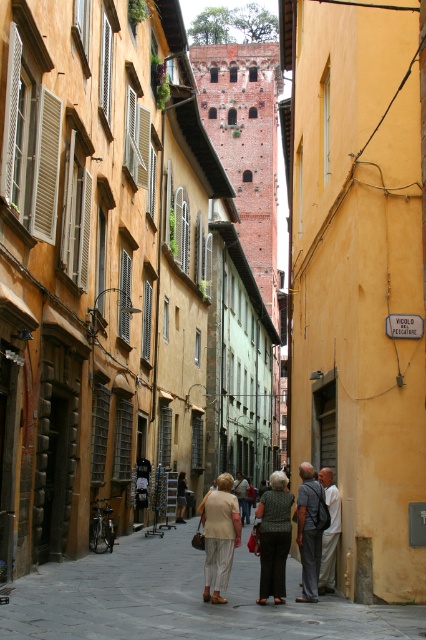
In the scene shown: You are standing at the entrance of the street and want to find the light beige pants at center. According to the coordinates provided, where should you look relative to the entrance?

The light beige pants at center is located at point 0.833 along the horizontal axis and 0.772 along the vertical axis from the entrance. Since the coordinates are based on the image frame, you should look towards the right and slightly downward from the entrance to find it.

You are a delivery person with a cart that is 2 meters wide. You need to navigate through the narrow street scene described. Can your cart pass between the matte beige pants at center and the light beige fabric coat at center without touching either?

The distance between the matte beige pants at center and the light beige fabric coat at center is 6.44 meters. Since the cart is only 2 meters wide, there is sufficient space for it to pass through without touching either object.